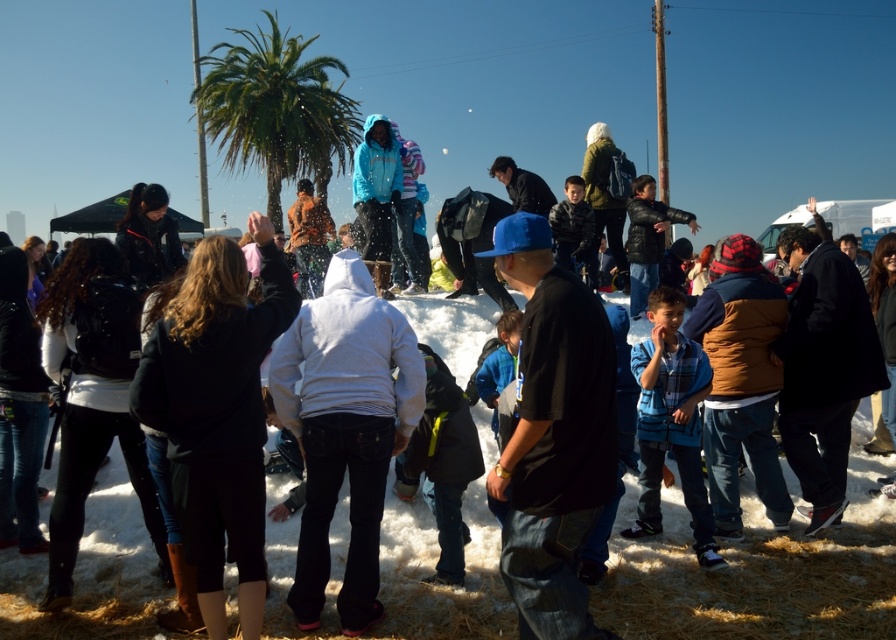
Question: Does black matte shirt at center appear under green leafy palm tree at upper center?

Choices:
 (A) no
 (B) yes

Answer: (B)

Question: Among these points, which one is nearest to the camera?

Choices:
 (A) (325, 96)
 (B) (518, 540)

Answer: (B)

Question: Can you confirm if black matte shirt at center is positioned above green leafy palm tree at upper center?

Choices:
 (A) yes
 (B) no

Answer: (B)

Question: Does black matte shirt at center appear on the right side of green leafy palm tree at upper center?

Choices:
 (A) yes
 (B) no

Answer: (A)

Question: Which point appears closest to the camera in this image?

Choices:
 (A) (266, 93)
 (B) (592, 339)

Answer: (B)